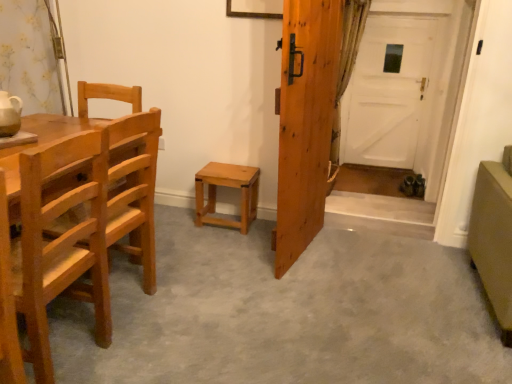
Locate an element on the screen. free spot to the right of light brown wood chair at left, the 2th chair viewed from the front is located at coordinates (186, 303).